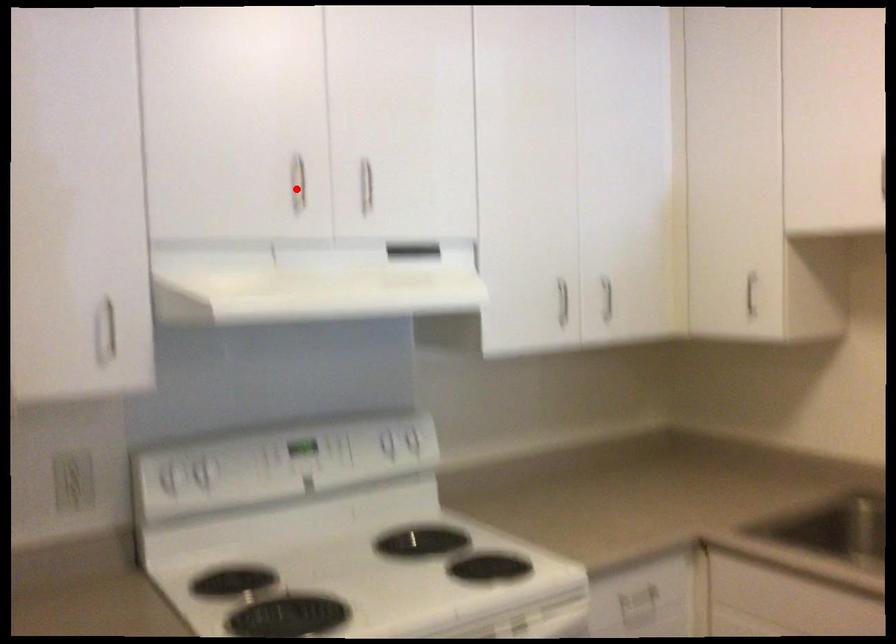
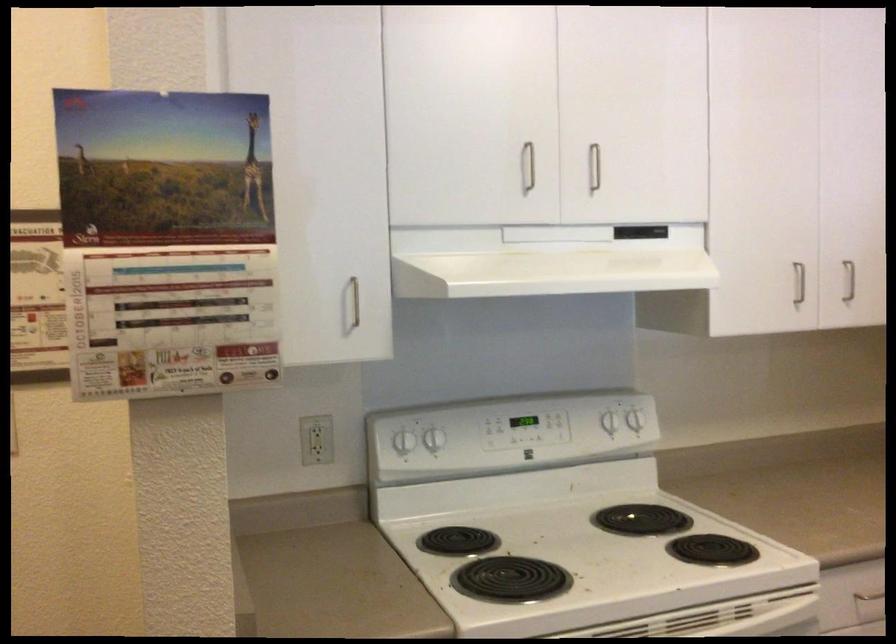
Question: I am providing you with two images of the same scene from different viewpoints. A red point is marked on the first image. Can you still see the location of the red point in image 2?

Choices:
 (A) Yes
 (B) No

Answer: (A)